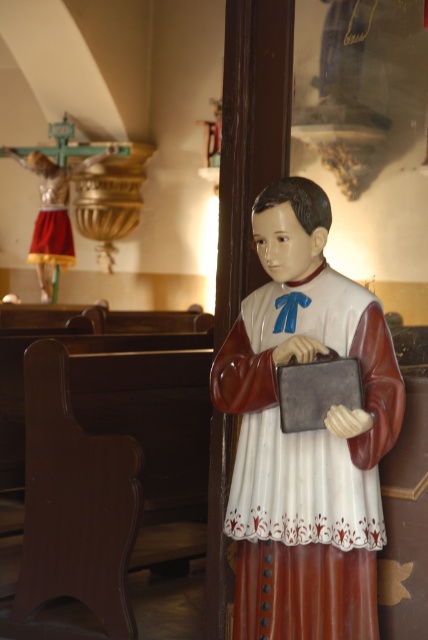
You are a visitor standing in the church and see the point at coordinates (305, 435). Which object in the scene does this point belong to?

The point at coordinates (305, 435) belongs to the matte plastic statue at center.

You are standing in the church and want to place a small offering at the base of the statue. The statue is located at point (354, 456). There is a crucifix at point (38, 161). Which point is closer to the statue where you should place the offering?

The statue is located at point (354, 456), so you should place the offering at that point.